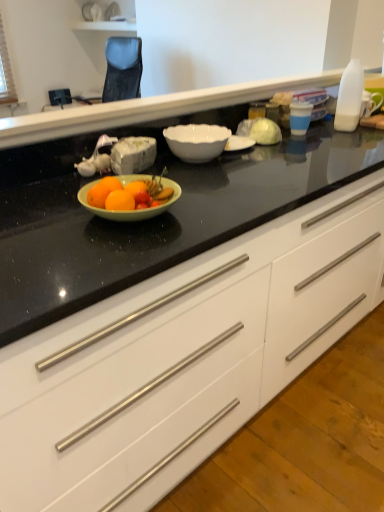
Question: Do you think black glossy countertop at center is within white glossy cabinet at center, or outside of it?

Choices:
 (A) inside
 (B) outside

Answer: (B)

Question: From a real-world perspective, is black glossy countertop at center positioned above or below white glossy cabinet at center?

Choices:
 (A) above
 (B) below

Answer: (A)

Question: Based on their relative distances, which object is nearer to the white glossy cabinet at center?

Choices:
 (A) black glossy countertop at center
 (B) white glossy bowl at center

Answer: (B)

Question: Which object is positioned farthest from the white glossy cabinet at center?

Choices:
 (A) black glossy countertop at center
 (B) white glossy bowl at center

Answer: (A)